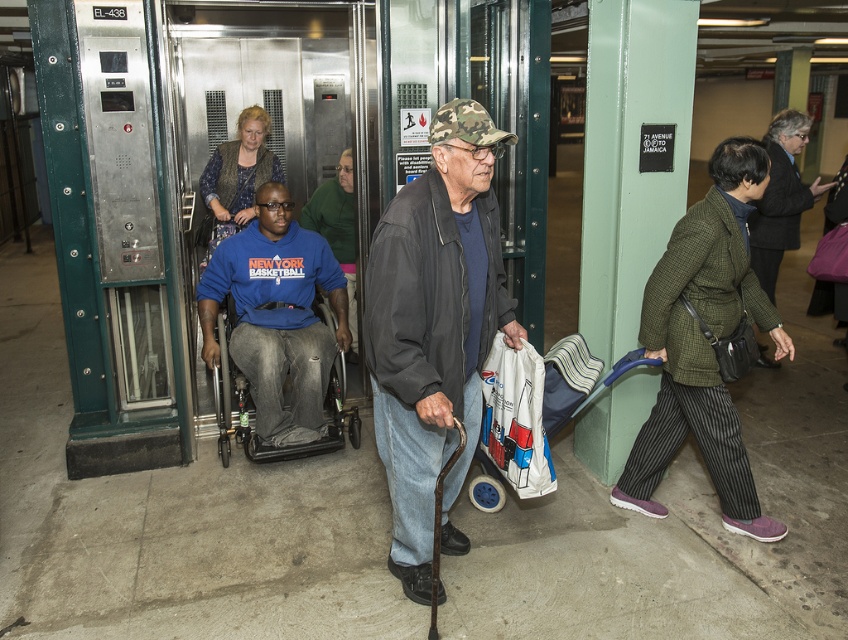
Can you confirm if blue cotton shirt at center is wider than white plastic bag at center?

Yes, blue cotton shirt at center is wider than white plastic bag at center.

Which is below, blue cotton shirt at center or white plastic bag at center?

white plastic bag at center

The image size is (848, 640). Identify the location of blue cotton shirt at center. (277, 316).

Who is positioned more to the left, camouflage fabric cap at center or white plastic bag at center?

camouflage fabric cap at center is more to the left.

Does camouflage fabric cap at center appear over white plastic bag at center?

Correct, camouflage fabric cap at center is located above white plastic bag at center.

Where is `camouflage fabric cap at center`? camouflage fabric cap at center is located at coordinates (434, 328).

Image resolution: width=848 pixels, height=640 pixels. What are the coordinates of `camouflage fabric cap at center` in the screenshot? It's located at (434, 328).

Is point (467, 195) positioned behind point (268, 403)?

No, it is not.

Is camouflage fabric cap at center wider than blue cotton shirt at center?

No.

Find the location of a particular element. camouflage fabric cap at center is located at coordinates (434, 328).

At what (x,y) coordinates should I click in order to perform the action: click on camouflage fabric cap at center. Please return your answer as a coordinate pair (x, y). The width and height of the screenshot is (848, 640). Looking at the image, I should click on (434, 328).